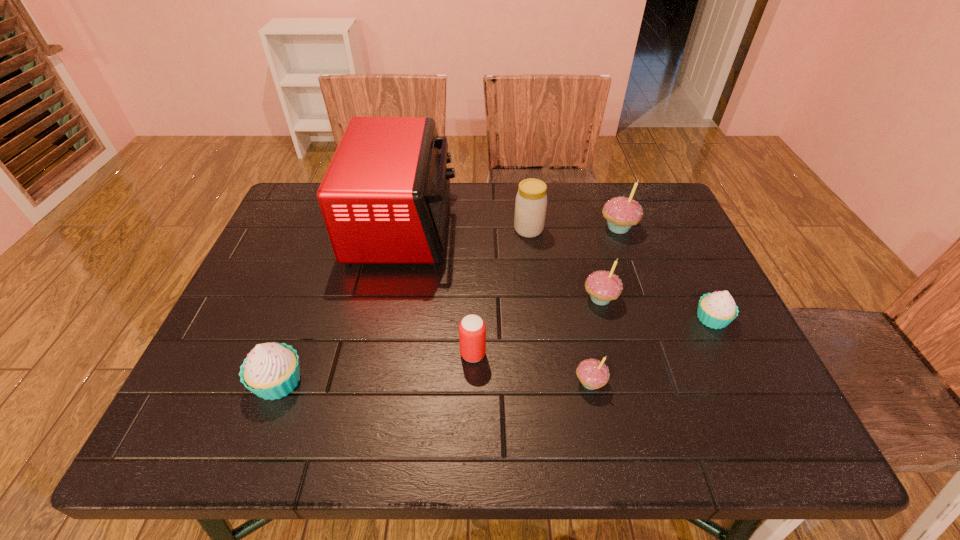
This screenshot has width=960, height=540. In the image, there is a desktop. Find the location of `vacant space at the left edge`. vacant space at the left edge is located at coordinates (308, 238).

In the image, there is a desktop. Identify the location of vacant space at the right edge. The image size is (960, 540). (707, 400).

Locate an element on the screen. The image size is (960, 540). vacant space at the far left corner of the desktop is located at coordinates (312, 192).

Locate an element on the screen. free region at the far right corner is located at coordinates (650, 204).

The height and width of the screenshot is (540, 960). Identify the location of vacant space in between the smallest pink cupcake and the tallest object. (496, 303).

You are a GUI agent. You are given a task and a screenshot of the screen. Output one action in this format:
    pyautogui.click(x=<x>, y=<y>)
    Task: Click on the unoccupied area between the nearest pink cupcake and the tallest object
    The width and height of the screenshot is (960, 540).
    Given the screenshot: What is the action you would take?
    496,303

Image resolution: width=960 pixels, height=540 pixels. I want to click on vacant area that lies between the leftmost cupcake and the biggest pink cupcake, so click(448, 305).

Image resolution: width=960 pixels, height=540 pixels. Identify the location of free space between the fourth object from left to right and the toaster oven. (466, 227).

You are a GUI agent. You are given a task and a screenshot of the screen. Output one action in this format:
    pyautogui.click(x=<x>, y=<y>)
    Task: Click on the vacant area that lies between the second farthest pink cupcake and the smallest pink cupcake
    The image size is (960, 540).
    Given the screenshot: What is the action you would take?
    pyautogui.click(x=595, y=341)

Identify the location of unoccupied position between the left white cupcake and the jar. (403, 306).